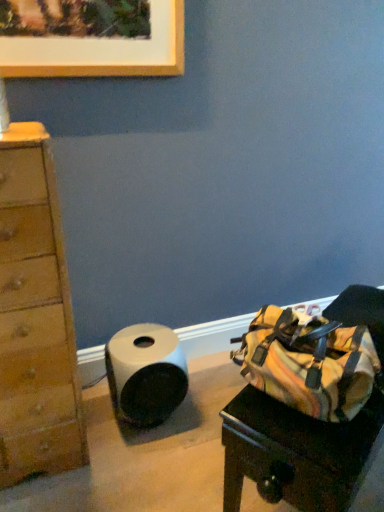
The image size is (384, 512). What are the coordinates of `vacant area that is situated to the right of white matte paper towel at lower left` in the screenshot? It's located at (203, 410).